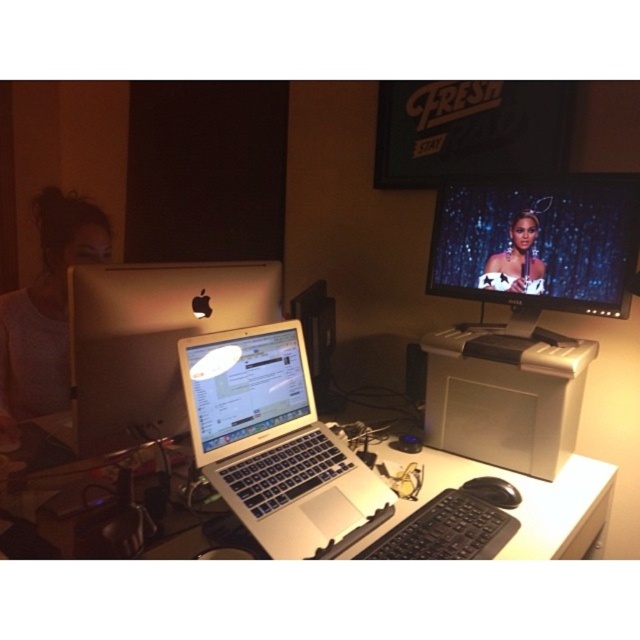
You are organizing cables for the satin silver monitor at upper right and the white plastic printer at center. Which device should you start with if you want to work on the one closer to you first?

You should start with the satin silver monitor at upper right because it is closer to you than the white plastic printer at center.

You are setting up a new monitor in this workspace. The satin silver monitor at upper right and the white plastic printer at center are both in your way. Which one do you need to move to make space for the new monitor?

The satin silver monitor at upper right is taller than the white plastic printer at center. Since the monitor is taller, it might require more vertical space. To make room for the new monitor, you should move the taller satin silver monitor at upper right first.

You are a delivery robot with a height of 1.5 meters. You need to deliver a package to the desk where the sleek silver laptop at center is located. Can you safely pass under the desk without hitting your head?

The distance of sleek silver laptop at center from camera is 1.04 meters. Since the robot is 1.5 meters tall, it is taller than the desk height, so it cannot pass under the desk safely without hitting its head.